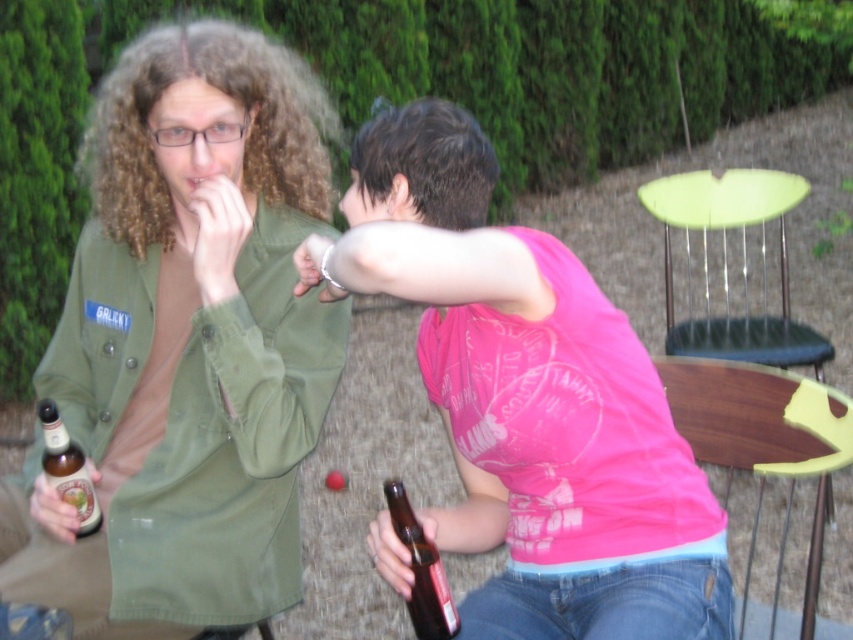
Which is behind, point (624, 516) or point (665, 392)?

Point (665, 392)

What do you see at coordinates (529, 400) in the screenshot? I see `pink cotton shirt at center` at bounding box center [529, 400].

This screenshot has height=640, width=853. What are the coordinates of `pink cotton shirt at center` in the screenshot? It's located at (529, 400).

Can you confirm if pink cotton shirt at center is bigger than brown glass bottle at lower center?

Yes.

Between point (393, 112) and point (410, 547), which one is positioned in front?

Positioned in front is point (410, 547).

You are a GUI agent. You are given a task and a screenshot of the screen. Output one action in this format:
    pyautogui.click(x=<x>, y=<y>)
    Task: Click on the pink cotton shirt at center
    The height and width of the screenshot is (640, 853).
    Given the screenshot: What is the action you would take?
    pyautogui.click(x=529, y=400)

Where is `pink cotton shirt at center`? pink cotton shirt at center is located at coordinates (x=529, y=400).

Does brown glass bottle at lower center appear on the left side of brown glass bottle at lower left?

No, brown glass bottle at lower center is not to the left of brown glass bottle at lower left.

Which is more to the left, brown glass bottle at lower center or brown glass bottle at lower left?

From the viewer's perspective, brown glass bottle at lower left appears more on the left side.

Who is more distant from viewer, (426, 548) or (76, 490)?

Point (76, 490)

At what (x,y) coordinates should I click in order to perform the action: click on brown glass bottle at lower center. Please return your answer as a coordinate pair (x, y). Image resolution: width=853 pixels, height=640 pixels. Looking at the image, I should click on point(421,570).